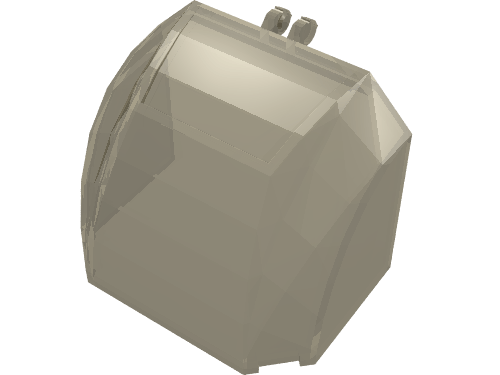
You are a GUI agent. You are given a task and a screenshot of the screen. Output one action in this format:
    pyautogui.click(x=<x>, y=<y>)
    Task: Click on the right hinge
    The height and width of the screenshot is (375, 500).
    Given the screenshot: What is the action you would take?
    pyautogui.click(x=273, y=13)